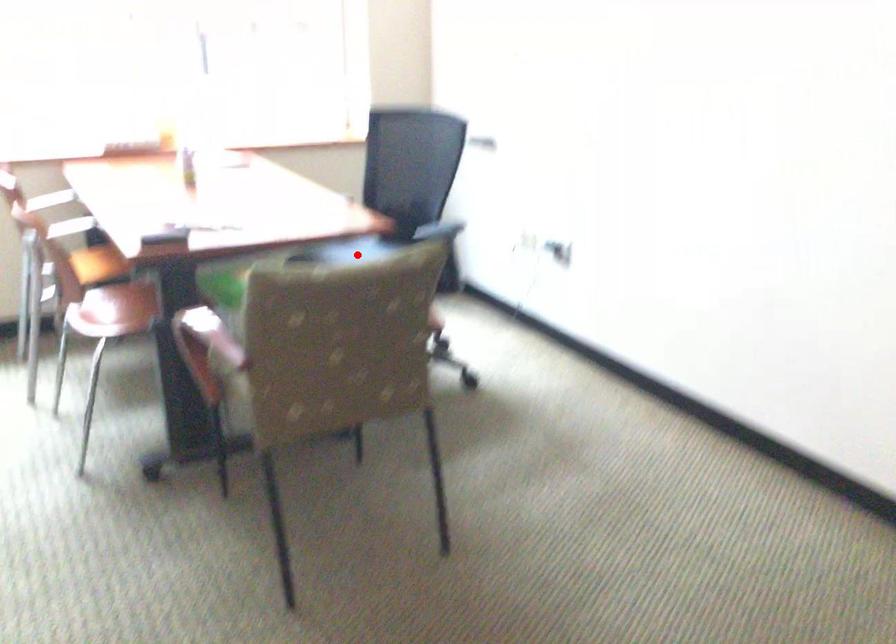
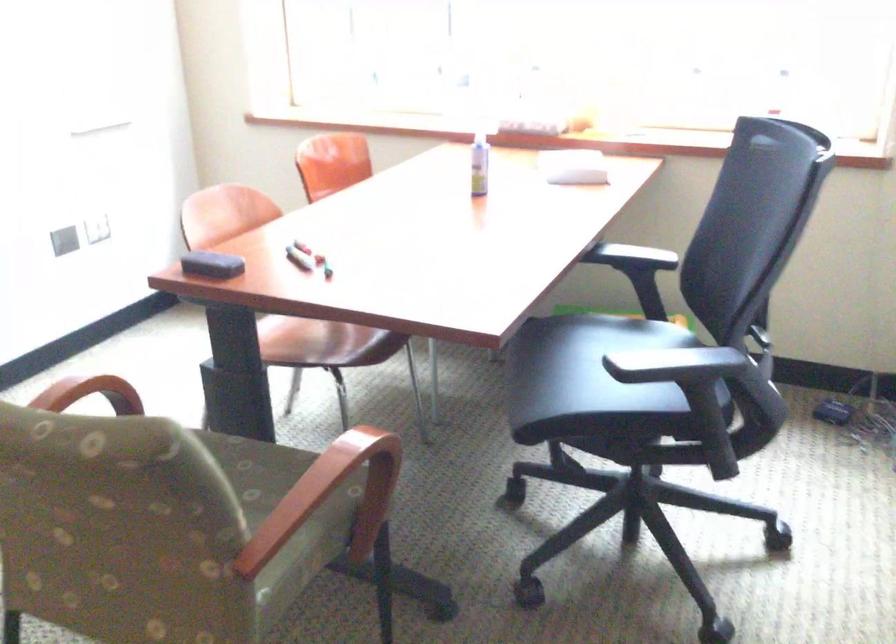
Question: I am providing you with two images of the same scene from different viewpoints. A red point is marked on the first image. Is the red point's position out of view in image 2?

Choices:
 (A) Yes
 (B) No

Answer: (B)